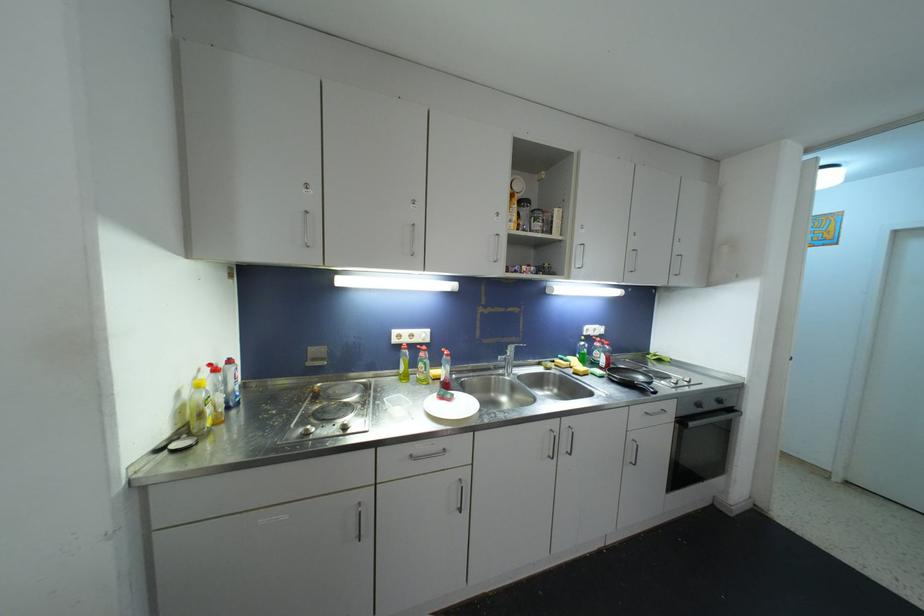
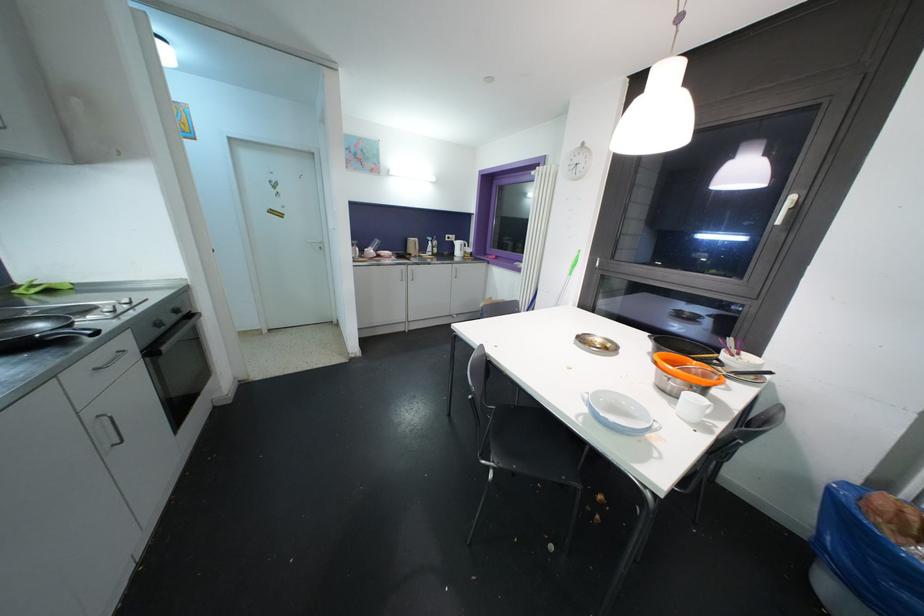
How did the camera likely rotate?

The camera rotated toward right-down.